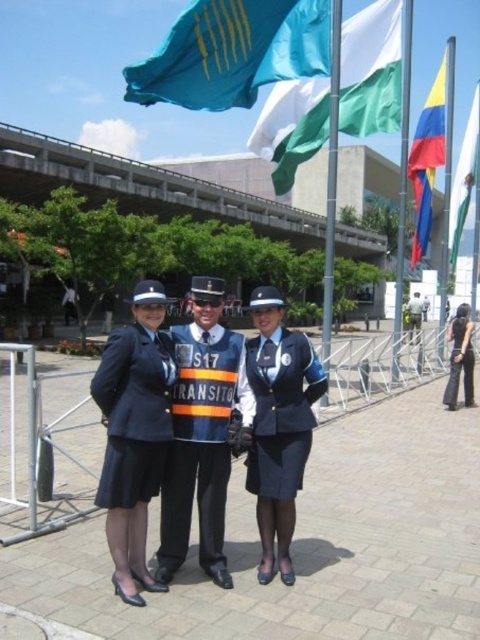
This screenshot has height=640, width=480. I want to click on reflective silver vest at center, so (202, 440).

Locate an element on the screen. This screenshot has width=480, height=640. reflective silver vest at center is located at coordinates (202, 440).

This screenshot has width=480, height=640. I want to click on reflective silver vest at center, so click(202, 440).

Between matte black uniform at center and black fabric skirt at lower right, which one appears on the left side from the viewer's perspective?

matte black uniform at center

Looking at this image, can you confirm if matte black uniform at center is positioned to the left of black fabric skirt at lower right?

Yes, matte black uniform at center is to the left of black fabric skirt at lower right.

Describe the element at coordinates (133, 435) in the screenshot. Image resolution: width=480 pixels, height=640 pixels. I see `matte black uniform at center` at that location.

Where is `matte black uniform at center`? This screenshot has width=480, height=640. matte black uniform at center is located at coordinates (133, 435).

Is red fabric flag at right below black fabric skirt at lower right?

Actually, red fabric flag at right is above black fabric skirt at lower right.

Is red fabric flag at right shorter than black fabric skirt at lower right?

No, red fabric flag at right is not shorter than black fabric skirt at lower right.

Describe the element at coordinates (428, 160) in the screenshot. The height and width of the screenshot is (640, 480). I see `red fabric flag at right` at that location.

At what (x,y) coordinates should I click in order to perform the action: click on red fabric flag at right. Please return your answer as a coordinate pair (x, y). The height and width of the screenshot is (640, 480). Looking at the image, I should click on [x=428, y=160].